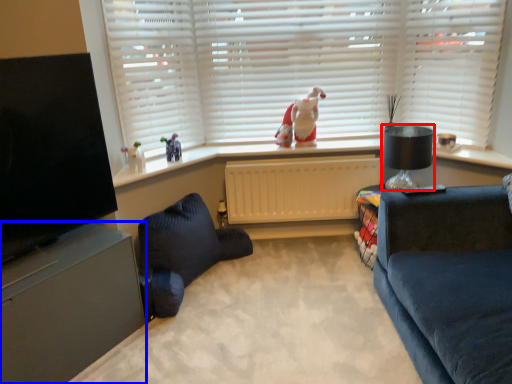
Question: Which object appears closest to the camera in this image, lamp (highlighted by a red box) or entertainment center (highlighted by a blue box)?

Choices:
 (A) lamp
 (B) entertainment center

Answer: (B)